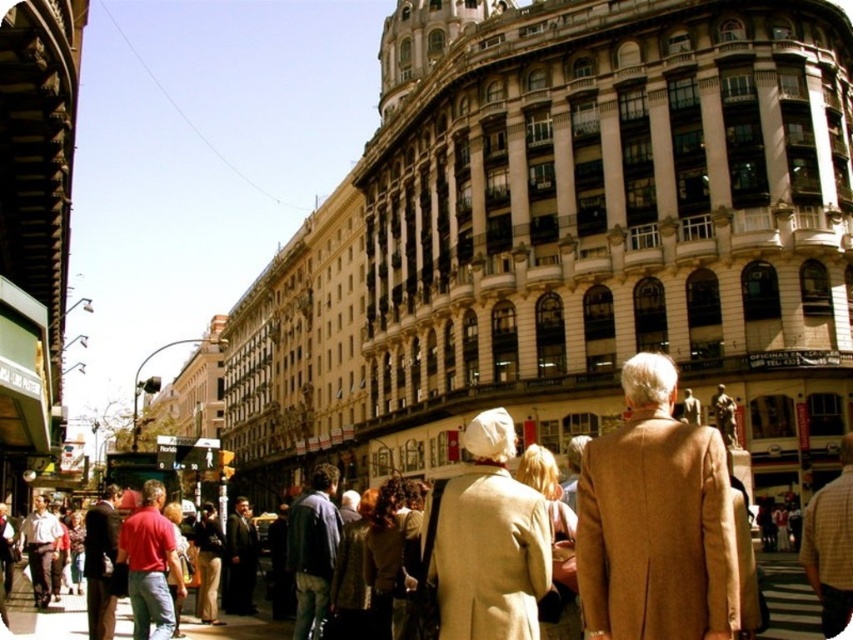
You are a photographer standing in the middle of the street. You want to take a photo of the tan wool coat at center and the smooth asphalt pavement at center. Which object is closer to the camera?

The tan wool coat at center is taller than the smooth asphalt pavement at center, so it is closer to the camera.

You are standing in front of the large ornate building and want to take a photo of both the point at coordinates (637, 403) and the point at coordinates (772, 621). Which point will appear larger in your photo?

The point at coordinates (637, 403) will appear larger in the photo because it is closer to the camera than the point at coordinates (772, 621).

You are a tailor observing the two coats in the image. The tan wool coat at center and the beige wool coat at center. Which coat would require more fabric to make, based on their sizes?

The tan wool coat at center requires more fabric than the beige wool coat at center because its width is larger, indicating it is bigger in size.